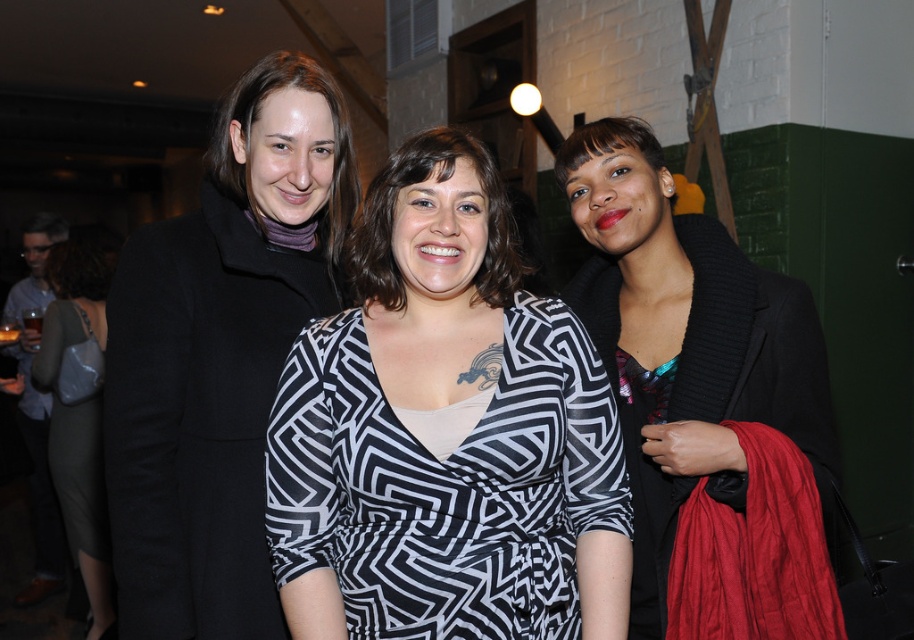
You are standing in front of the three women and want to determine which of the two points, point (316, 97) or point (646, 570), is nearer to you. Which one would you say is closer?

Point (316, 97) is closer to the viewer than point (646, 570).

You are standing in the room and want to pick up the black wool coat at left. According to the spatial coordinates provided, where exactly should you look to find it?

The black wool coat at left is located at point (x=220, y=355), so you should look there to find it.